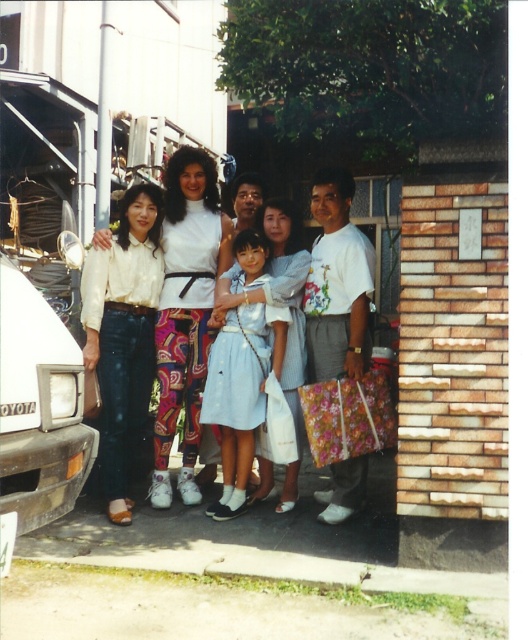
You are a photographer trying to frame a shot of the black matte van at left and the light blue denim dress at center. Since you want to ensure both are visible in your photo, which object should you prioritize positioning closer to the camera to avoid cropping?

The black matte van at left has a smaller width than the light blue denim dress at center, so to ensure both fit in the frame, position the black matte van at left closer to the camera since it is narrower and requires less space.

You are standing in front of the group photo and need to locate the white matte blouse at center. According to the coordinates provided, where exactly is it positioned?

The white matte blouse at center is located at point 0.487 on the x axis and 0.352 on the y axis.

You are a photographer trying to focus on the light blue fabric dress at center. There is a white matte blouse at center in front of it. Can you adjust your camera to focus on the dress without moving any people?

The white matte blouse at center is closer to the viewer than the light blue fabric dress at center, so adjusting the focus to a longer focal length or using a smaller aperture could help bring the dress into focus while keeping the blouse slightly blurred. Alternatively, moving the camera position slightly backward might also help achieve the desired focus on the dress.